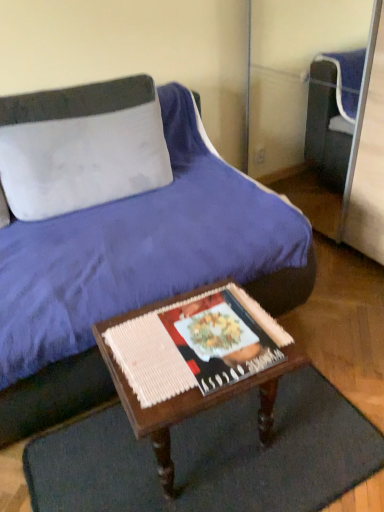
Locate an element on the screen. The image size is (384, 512). free point above wooden table at center (from a real-world perspective) is located at coordinates (191, 337).